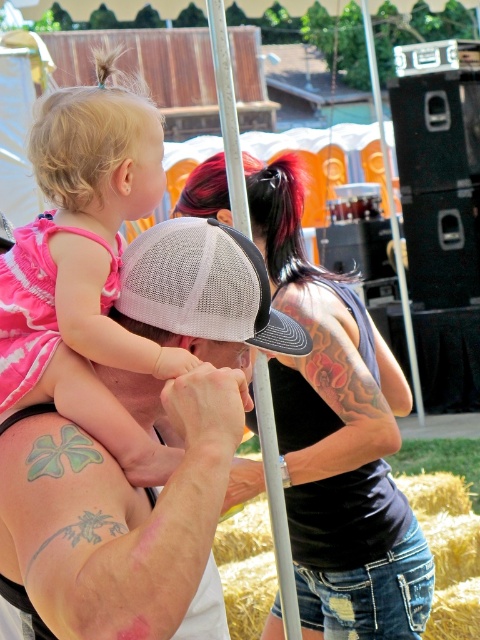
Question: Which point is closer to the camera taking this photo?

Choices:
 (A) (256, 280)
 (B) (133, 99)
 (C) (243, 204)

Answer: (A)

Question: Does rusty straw bale at lower right come in front of silver metallic pole at center?

Choices:
 (A) no
 (B) yes

Answer: (A)

Question: Which object is farther from the camera taking this photo?

Choices:
 (A) rusty straw bale at lower right
 (B) pink fabric dress at upper left
 (C) white mesh cap at center
 (D) silver metallic pole at center

Answer: (A)

Question: In this image, where is black mesh cap at center located relative to silver metallic pole at center?

Choices:
 (A) below
 (B) above

Answer: (A)

Question: Where is rusty straw bale at lower right located in relation to silver metallic pole at center in the image?

Choices:
 (A) above
 (B) below

Answer: (B)

Question: Which of the following is the closest to the observer?

Choices:
 (A) pink fabric dress at upper left
 (B) white mesh baseball cap at center
 (C) rusty straw bale at lower right

Answer: (A)